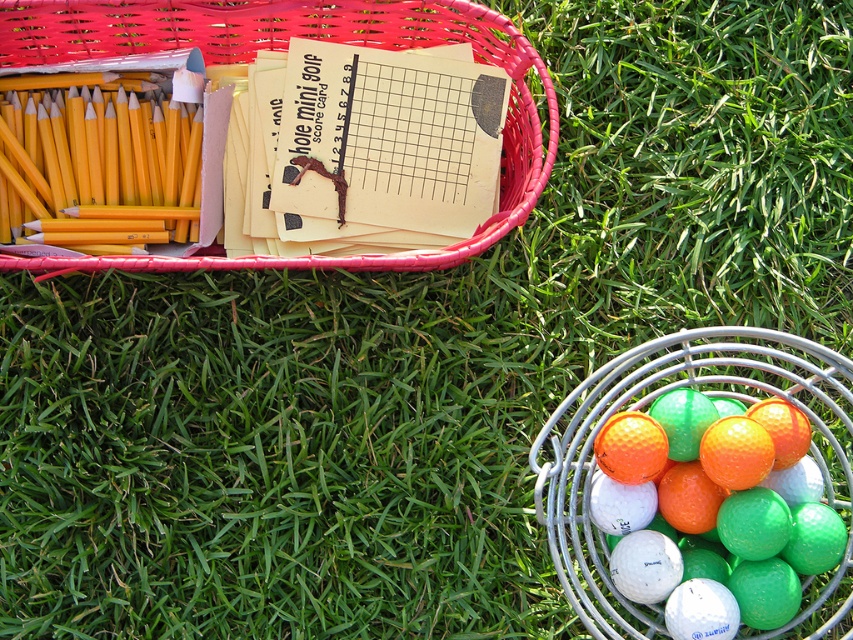
You are organizing a mini golf tournament and need to place the matte plastic basket at upper left and the rubberized plastic golf balls at right on a table. The table has limited space. Which object should you prioritize placing first to ensure both fit?

The matte plastic basket at upper left should be placed first since it has a larger size compared to the rubberized plastic golf balls at right, ensuring there is enough space left for the smaller items.

You are a golfer who wants to place the white matte golf ball at lower right into the matte plastic basket at upper left. Can you fit it inside based on their sizes?

The matte plastic basket at upper left is much taller than the white matte golf ball at lower right, so the ball should fit inside the basket.